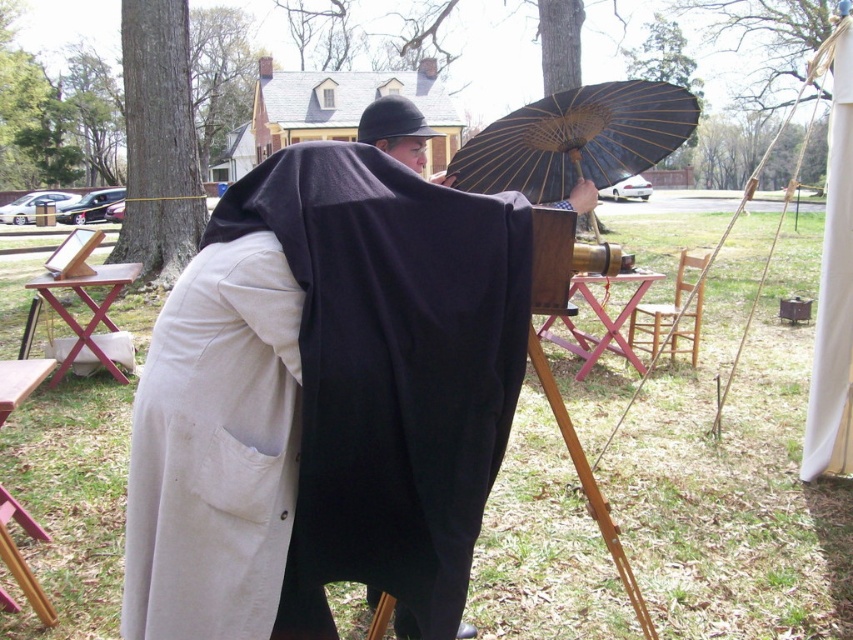
You are a photographer in the scene and need to place your camera on a stable surface. Which object, the white cotton robe at center or the brown wood picnic table at left, would be the better choice for placing the camera?

The brown wood picnic table at left is a better choice for placing the camera because the white cotton robe at center is positioned to the right of the picnic table and is likely not a stable surface for the camera.

You are a photographer trying to set up your equipment in the scene. You need to place your camera between the white cotton robe at center and the pink wood picnic table at center. Is there enough space for you to position your camera there?

The white cotton robe at center and the pink wood picnic table at center are 3.75 meters apart from each other, so there is sufficient space to place the camera between them.

You are planning to set up a picnic and have a large blanket that can only fit on a picnic table with a minimum width of 1.2 meters. You see the wooden picnic table at lower left and the brown wood picnic table at left in the scene. Which picnic table should you choose to place your blanket?

The brown wood picnic table at left has a greater width than the wooden picnic table at lower left. Since the blanket requires a minimum of 1.2 meters, you should choose the brown wood picnic table at left to ensure there is enough space.